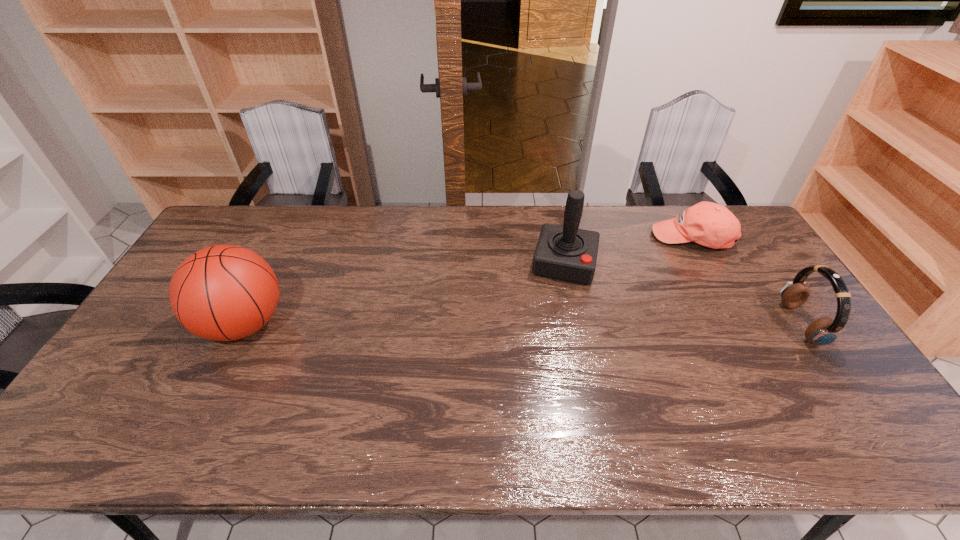
Locate an element on the screen. Image resolution: width=960 pixels, height=540 pixels. vacant space that satisfies the following two spatial constraints: 1. on the front side of the rightmost object; 2. on the ear cup of the joystick is located at coordinates (577, 324).